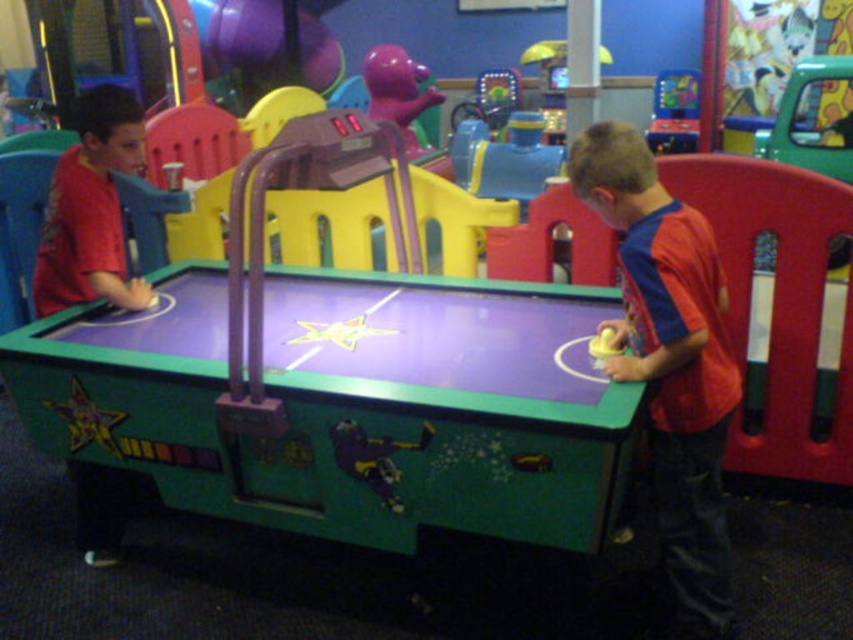
Question: Which of the following is the closest to the observer?

Choices:
 (A) matte red shirt at right
 (B) metallic blue arcade machine at upper right

Answer: (A)

Question: Does matte red shirt at right come in front of metallic blue arcade machine at upper right?

Choices:
 (A) yes
 (B) no

Answer: (A)

Question: Can you confirm if purple matte bear at upper center is positioned above metallic blue arcade machine at upper right?

Choices:
 (A) no
 (B) yes

Answer: (A)

Question: Among these objects, which one is farthest from the camera?

Choices:
 (A) matte red shirt at right
 (B) purple matte bear at upper center
 (C) metallic blue arcade machine at upper right

Answer: (C)

Question: Which point appears closest to the camera in this image?

Choices:
 (A) (682, 108)
 (B) (712, 336)

Answer: (B)

Question: From the image, what is the correct spatial relationship of matte red shirt at right in relation to metallic blue arcade machine at upper right?

Choices:
 (A) below
 (B) above

Answer: (A)